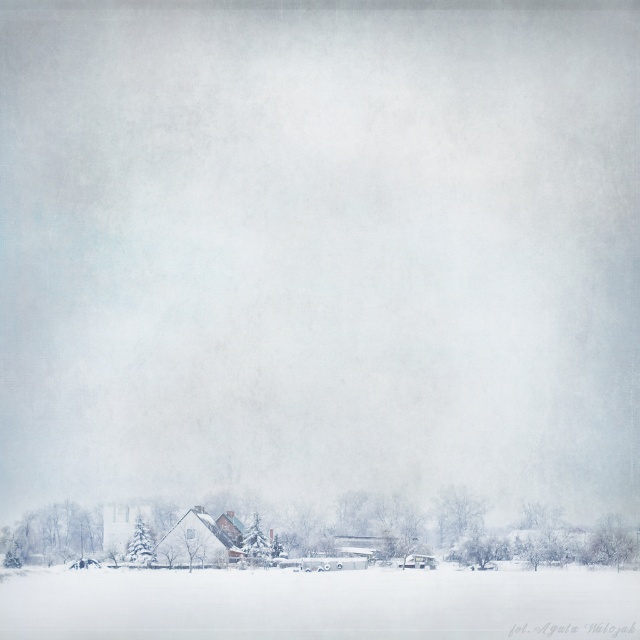
Question: Which is nearer to the snow-covered tree at lower left?

Choices:
 (A) white snowfield at lower center
 (B) snow-covered tree at lower center

Answer: (A)

Question: Is snow-covered tree at lower left bigger than white snow-covered tree at lower right?

Choices:
 (A) no
 (B) yes

Answer: (B)

Question: Which point is farther to the camera?

Choices:
 (A) (83, 529)
 (B) (608, 531)
 (C) (458, 490)

Answer: (A)

Question: Does snow-covered tree at lower left appear under green matte tree at lower left?

Choices:
 (A) no
 (B) yes

Answer: (A)

Question: Is white snowfield at lower center positioned behind snow-covered tree at lower center?

Choices:
 (A) no
 (B) yes

Answer: (A)

Question: Which point is farther to the camera?

Choices:
 (A) white snowfield at lower center
 (B) snow-covered tree at lower center
 (C) snow-covered evergreen at bottom

Answer: (B)